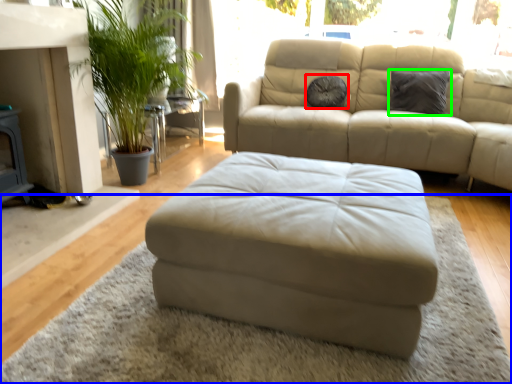
Question: Based on their relative distances, which object is nearer to pillow (highlighted by a red box)? Choose from mat (highlighted by a blue box) and pillow (highlighted by a green box).

Choices:
 (A) mat
 (B) pillow

Answer: (B)